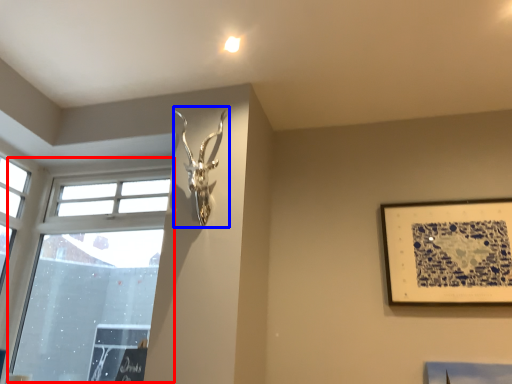
Question: Which point is further to the camera, window (highlighted by a red box) or sculpture (highlighted by a blue box)?

Choices:
 (A) window
 (B) sculpture

Answer: (A)